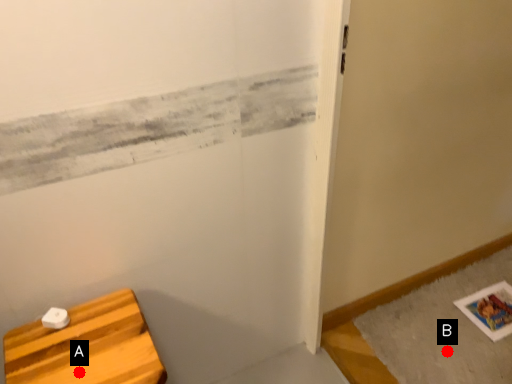
Question: Two points are circled on the image, labeled by A and B beside each circle. Which point appears farthest from the camera in this image?

Choices:
 (A) A is further
 (B) B is further

Answer: (B)